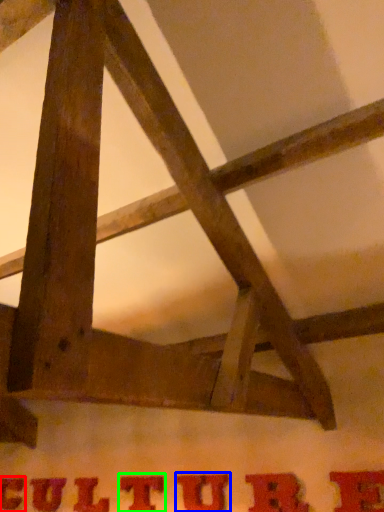
Question: Considering the real-world distances, which object is closest to letter (highlighted by a red box)? letter (highlighted by a blue box) or letter (highlighted by a green box).

Choices:
 (A) letter
 (B) letter

Answer: (B)